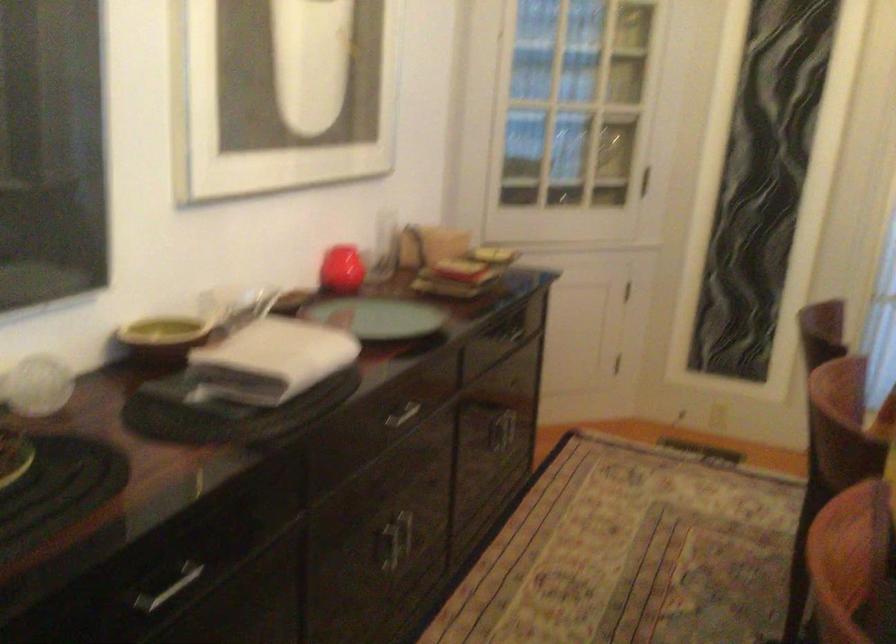
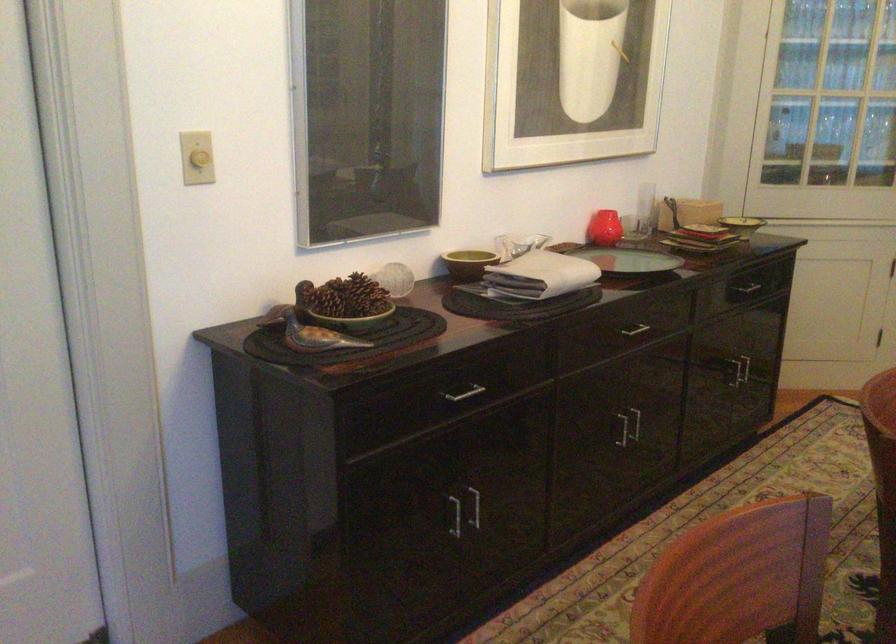
In the second image, find the point that corresponds to (457,270) in the first image.

(704, 230)